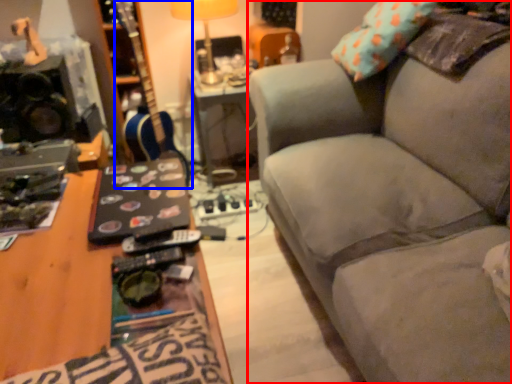
Question: Among these objects, which one is nearest to the camera, studio couch (highlighted by a red box) or guitar (highlighted by a blue box)?

Choices:
 (A) studio couch
 (B) guitar

Answer: (A)